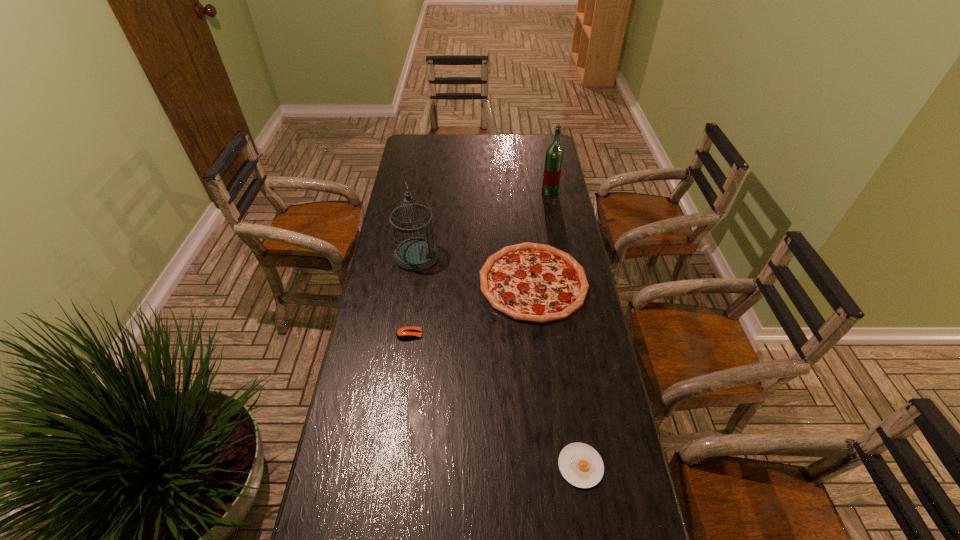
The height and width of the screenshot is (540, 960). In the image, there is a desktop. In order to click on free region at the far right corner in this screenshot , I will do `click(536, 135)`.

Identify the location of empty space between the birdcage and the nearest object. (498, 361).

Find the location of a particular element. free space that is in between the birdcage and the second nearest object is located at coordinates (413, 295).

Find the location of a particular element. The height and width of the screenshot is (540, 960). vacant space in between the farthest object and the birdcage is located at coordinates (483, 224).

Identify the location of unoccupied area between the farthest object and the birdcage. The height and width of the screenshot is (540, 960). (483, 224).

The width and height of the screenshot is (960, 540). In order to click on empty space that is in between the birdcage and the farthest object in this screenshot , I will do `click(483, 224)`.

This screenshot has height=540, width=960. What are the coordinates of `free space between the liquor and the pizza` in the screenshot? It's located at (541, 237).

The height and width of the screenshot is (540, 960). Find the location of `free spot between the birdcage and the egg yolk`. free spot between the birdcage and the egg yolk is located at coordinates (498, 361).

Locate an element on the screen. The image size is (960, 540). free space between the computer mouse and the birdcage is located at coordinates (413, 295).

At what (x,y) coordinates should I click in order to perform the action: click on free space between the egg yolk and the third shortest object. Please return your answer as a coordinate pair (x, y). The width and height of the screenshot is (960, 540). Looking at the image, I should click on (557, 374).